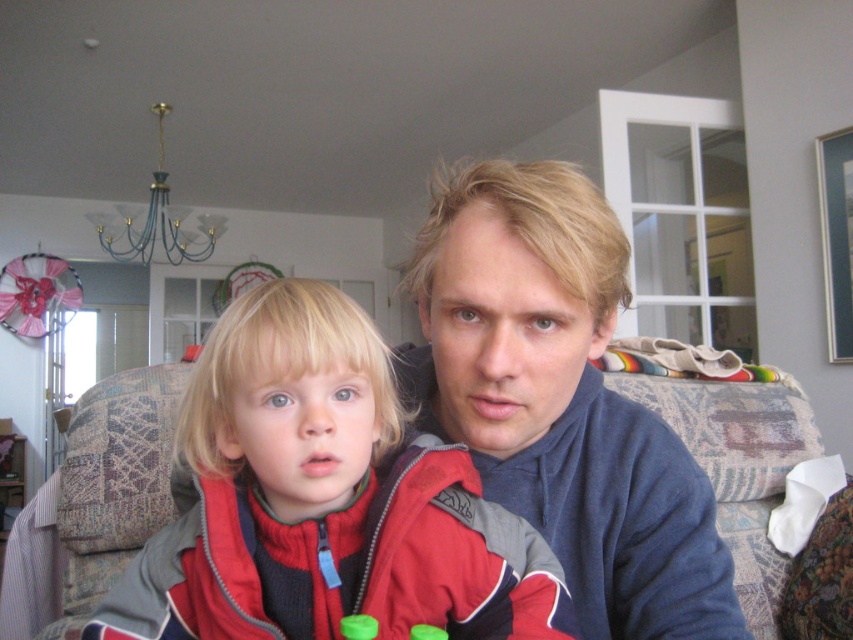
Question: Can you confirm if matte red jacket at center is positioned to the right of blue fleece at center?

Choices:
 (A) no
 (B) yes

Answer: (A)

Question: Can you confirm if matte red jacket at center is positioned to the right of blue fleece at center?

Choices:
 (A) no
 (B) yes

Answer: (A)

Question: Which point is farther to the camera?

Choices:
 (A) (357, 556)
 (B) (680, 637)

Answer: (B)

Question: Can you confirm if matte red jacket at center is thinner than blue fleece at center?

Choices:
 (A) yes
 (B) no

Answer: (B)

Question: Among these points, which one is farthest from the camera?

Choices:
 (A) (288, 355)
 (B) (654, 496)

Answer: (B)